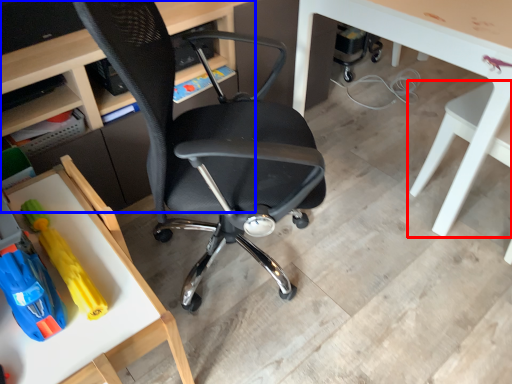
Question: Which object is further to the camera taking this photo, chair (highlighted by a red box) or desk (highlighted by a blue box)?

Choices:
 (A) chair
 (B) desk

Answer: (B)